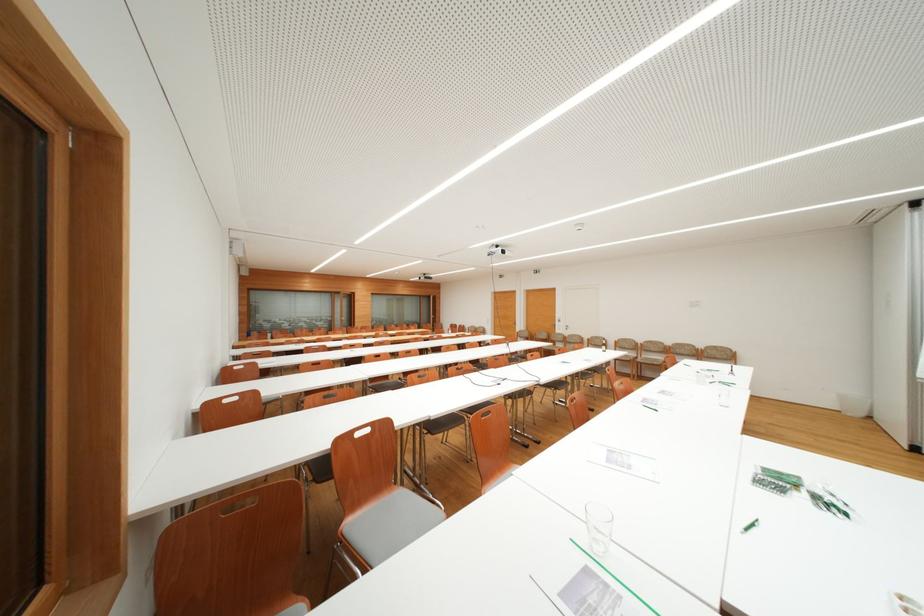
This screenshot has height=616, width=924. What do you see at coordinates (565, 328) in the screenshot?
I see `the white door handle` at bounding box center [565, 328].